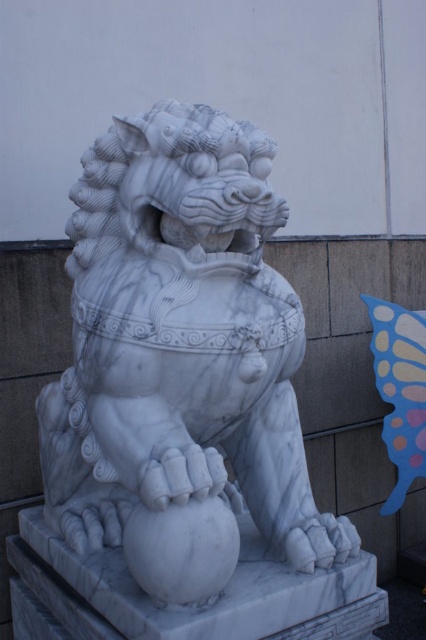
Question: Is white marble lion at center above blue paper butterfly at upper right?

Choices:
 (A) yes
 (B) no

Answer: (A)

Question: Can you confirm if white marble lion at center is smaller than blue paper butterfly at upper right?

Choices:
 (A) no
 (B) yes

Answer: (A)

Question: Which of the following is the closest to the observer?

Choices:
 (A) white marble lion at center
 (B) blue paper butterfly at upper right

Answer: (A)

Question: Does white marble lion at center have a smaller size compared to blue paper butterfly at upper right?

Choices:
 (A) no
 (B) yes

Answer: (A)